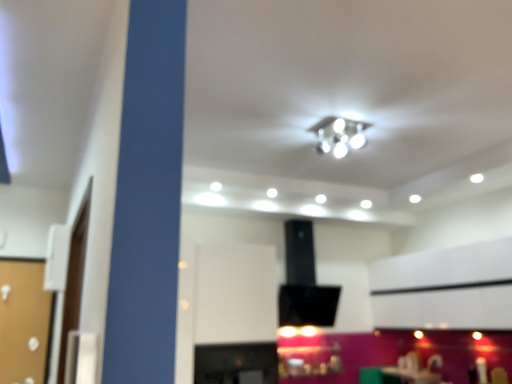
Question: Which is correct: white glossy light fixture at upper center is inside matte white table at lower center, or outside of it?

Choices:
 (A) inside
 (B) outside

Answer: (B)

Question: Looking at the image, does white glossy light fixture at upper center seem bigger or smaller compared to matte white table at lower center?

Choices:
 (A) big
 (B) small

Answer: (B)

Question: From their relative heights in the image, would you say white glossy light fixture at upper center is taller or shorter than matte white table at lower center?

Choices:
 (A) short
 (B) tall

Answer: (A)

Question: From the image's perspective, is matte white table at lower center positioned above or below white glossy light fixture at upper center?

Choices:
 (A) below
 (B) above

Answer: (A)

Question: Considering the positions of matte white table at lower center and white glossy light fixture at upper center in the image, is matte white table at lower center wider or thinner than white glossy light fixture at upper center?

Choices:
 (A) wide
 (B) thin

Answer: (A)

Question: Is matte white table at lower center inside or outside of white glossy light fixture at upper center?

Choices:
 (A) outside
 (B) inside

Answer: (A)

Question: In the image, is matte white table at lower center on the left side or the right side of white glossy light fixture at upper center?

Choices:
 (A) left
 (B) right

Answer: (B)